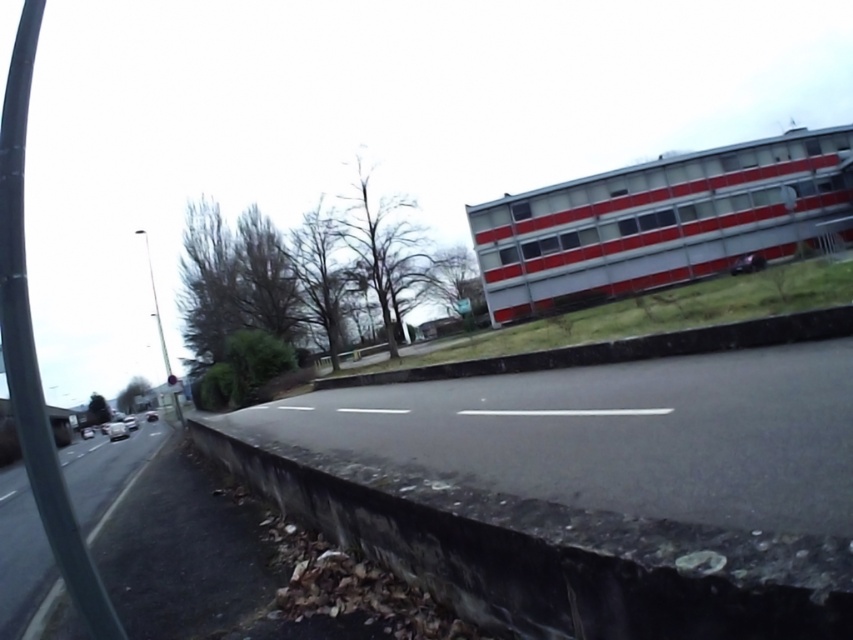
Is concrete at center smaller than silver metallic car at center?

Indeed, concrete at center has a smaller size compared to silver metallic car at center.

Which is more to the right, concrete at center or silver metallic car at center?

Positioned to the right is concrete at center.

Does point (589, 346) come behind point (128, 428)?

No, (589, 346) is closer to viewer.

In order to click on concrete at center in this screenshot , I will do `click(625, 348)`.

Which is more to the right, silver metallic car at lower left or white glossy car at lower left?

silver metallic car at lower left is more to the right.

Looking at this image, can you confirm if silver metallic car at lower left is thinner than white glossy car at lower left?

Yes.

What do you see at coordinates (86, 433) in the screenshot?
I see `silver metallic car at lower left` at bounding box center [86, 433].

The image size is (853, 640). Identify the location of silver metallic car at lower left. (86, 433).

Is metallic silver car at right bigger than silver metallic car at center?

No, metallic silver car at right is not bigger than silver metallic car at center.

What do you see at coordinates (747, 262) in the screenshot? Image resolution: width=853 pixels, height=640 pixels. I see `metallic silver car at right` at bounding box center [747, 262].

Which is in front, point (753, 269) or point (135, 422)?

Point (753, 269)

The height and width of the screenshot is (640, 853). What are the coordinates of `metallic silver car at right` in the screenshot? It's located at (747, 262).